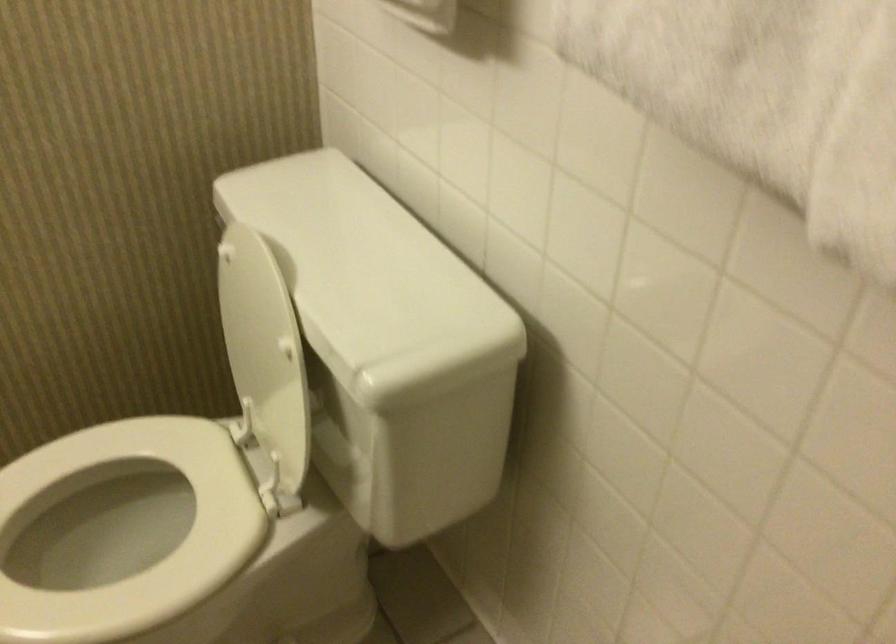
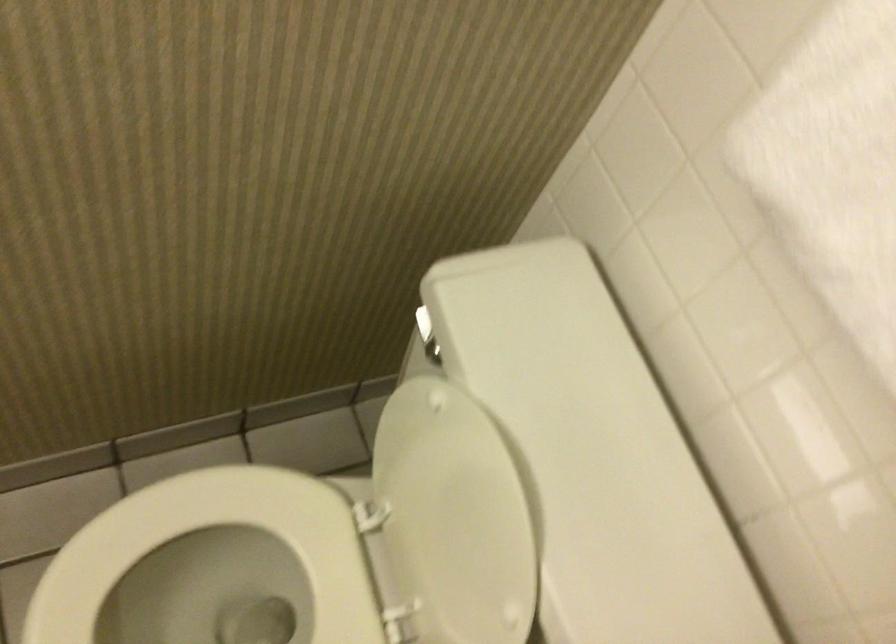
The point at (147,564) is marked in the first image. Where is the corresponding point in the second image?

(222, 590)